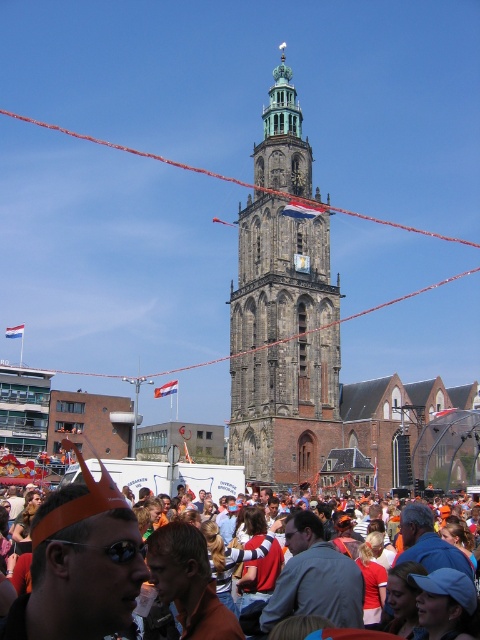
You are a photographer trying to capture the stone brick bell tower at center without any people in the frame. Based on the scene, is the orange fabric crowd at lower center blocking your view of the tower?

The orange fabric crowd at lower center is behind the stone brick bell tower at center, so they are not blocking the view of the tower. You can capture the tower without any people in the frame.

You are standing at the base of the historic stone tower and want to take a photo of the point at coordinate point (280, 323). If your camera has a maximum focus range of 100 meters, will you be able to capture the point clearly?

The distance of point (280, 323) from the camera is 86.48 meters, which is within the camera maximum focus range of 100 meters. Therefore, you can capture the point clearly.